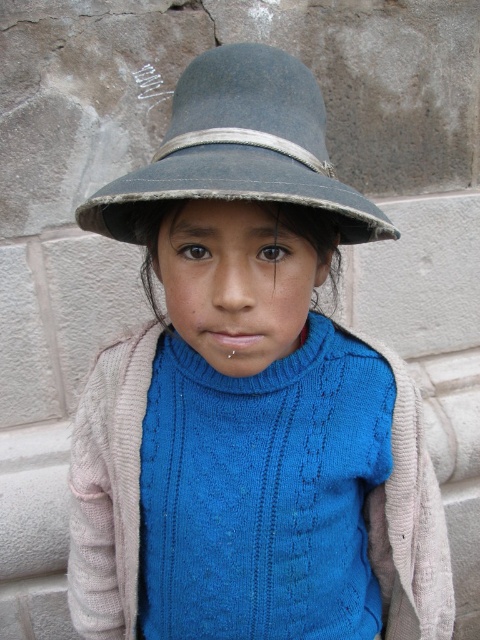
How much distance is there between worn blue fabric hat at upper center and blue knitted sweater at center?

A distance of 7.62 centimeters exists between worn blue fabric hat at upper center and blue knitted sweater at center.

Is point (159, 182) positioned before point (170, 228)?

Yes, point (159, 182) is in front of point (170, 228).

Locate an element on the screen. This screenshot has height=640, width=480. worn blue fabric hat at upper center is located at coordinates (239, 148).